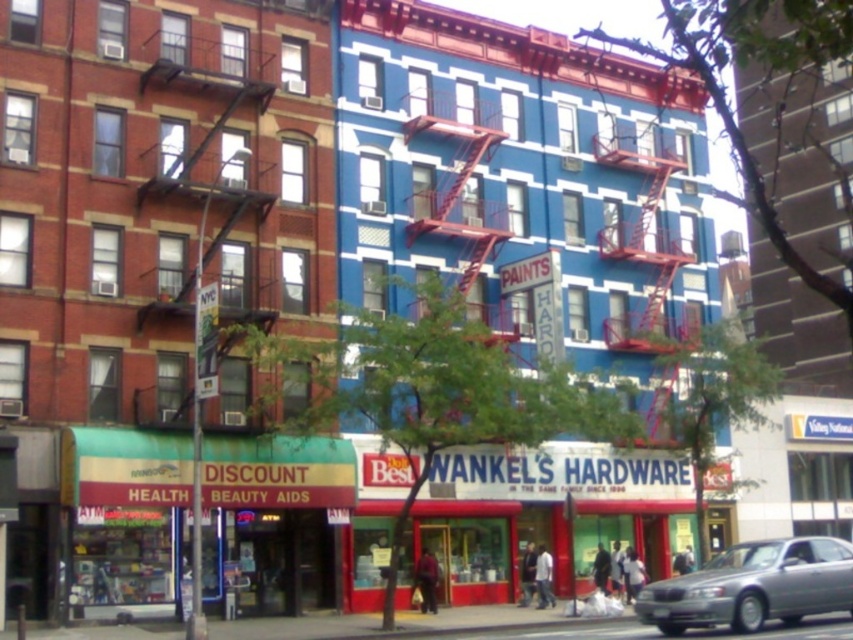
Can you confirm if green fabric health aid store at lower left is smaller than silver metallic car at lower right?

Yes, green fabric health aid store at lower left is smaller than silver metallic car at lower right.

Can you confirm if green fabric health aid store at lower left is positioned to the right of silver metallic car at lower right?

Incorrect, green fabric health aid store at lower left is not on the right side of silver metallic car at lower right.

Identify the location of green fabric health aid store at lower left. (277, 472).